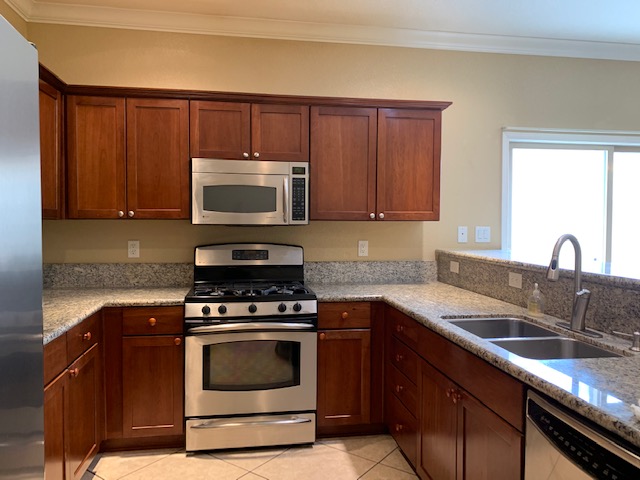
In order to click on floor tiles in this screenshot , I will do `click(328, 470)`, `click(156, 473)`.